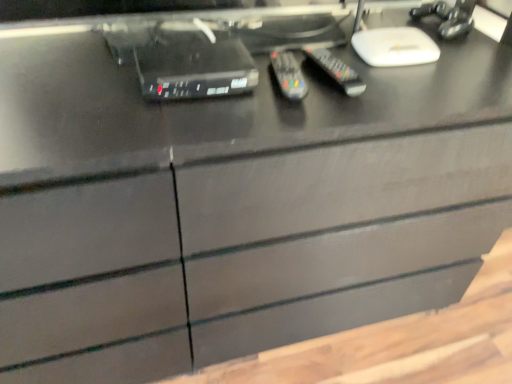
At what (x,y) coordinates should I click in order to perform the action: click on free space behind black plastic remote at center, acting as the first control starting from the right. Please return your answer as a coordinate pair (x, y). Looking at the image, I should click on (336, 41).